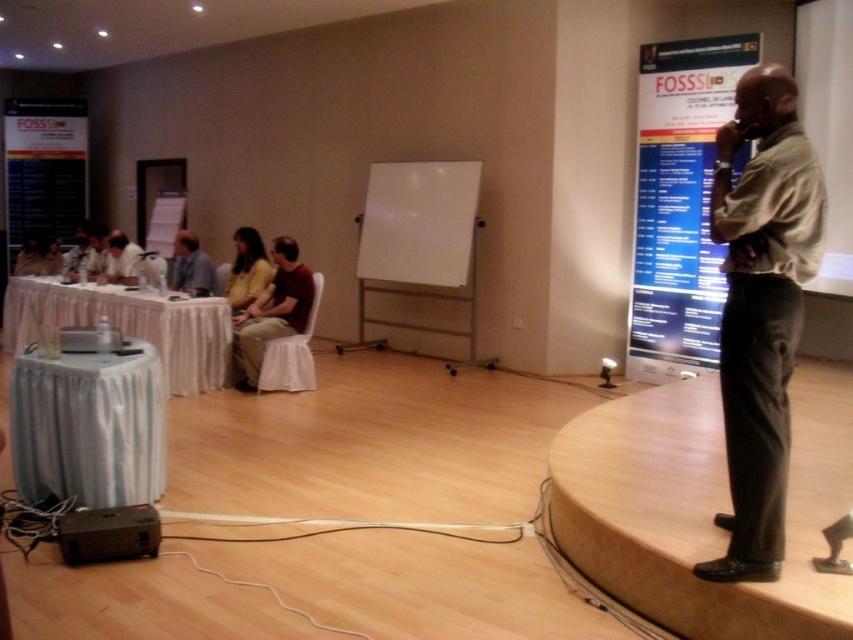
Question: Among these points, which one is farthest from the camera?

Choices:
 (A) (137, 268)
 (B) (628, 480)
 (C) (257, 369)

Answer: (A)

Question: Which of the following is the closest to the observer?

Choices:
 (A) matte brown shirt at center
 (B) silver fabric-covered table at lower left

Answer: (B)

Question: In this image, where is matte brown shirt at center located relative to matte white chair at center?

Choices:
 (A) below
 (B) above

Answer: (A)

Question: Does matte brown shirt at center appear on the left side of yellow fabric chair at center?

Choices:
 (A) yes
 (B) no

Answer: (B)

Question: Can you confirm if white fabric tablecloth at left is positioned to the right of matte white chair at center?

Choices:
 (A) no
 (B) yes

Answer: (B)

Question: Based on their relative distances, which object is farther from the khaki cotton shirt at right?

Choices:
 (A) black plastic projector at lower left
 (B) white draped table at left
 (C) white paperboard at left
 (D) matte brown shirt at center

Answer: (C)